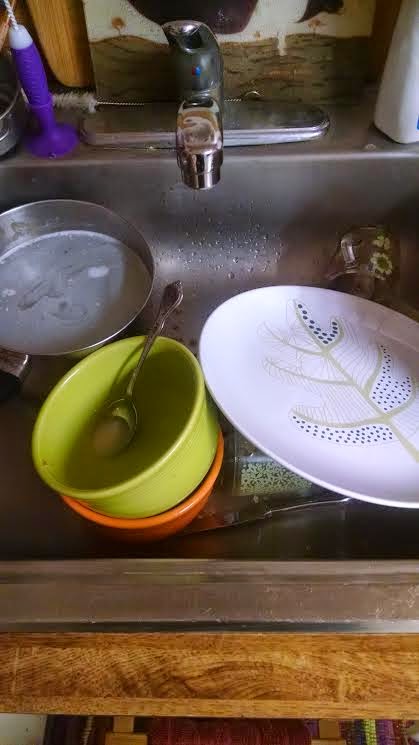
Locate an element on the screen. The width and height of the screenshot is (419, 745). blue cold side of faucet is located at coordinates click(x=198, y=72).